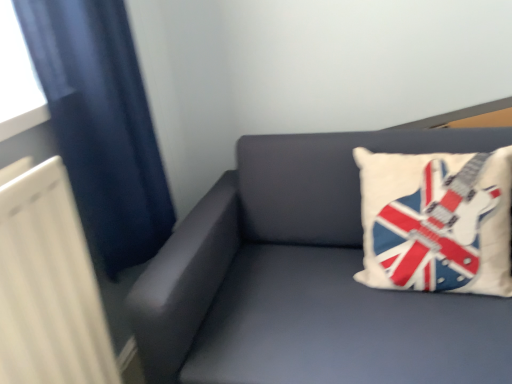
Question: Are white fabric pillow with guitar design at upper right and matte gray couch at upper right located far from each other?

Choices:
 (A) yes
 (B) no

Answer: (B)

Question: Is the position of white fabric pillow with guitar design at upper right more distant than that of matte gray couch at upper right?

Choices:
 (A) yes
 (B) no

Answer: (A)

Question: Is white fabric pillow with guitar design at upper right bigger than matte gray couch at upper right?

Choices:
 (A) no
 (B) yes

Answer: (A)

Question: From the image's perspective, is white fabric pillow with guitar design at upper right under matte gray couch at upper right?

Choices:
 (A) no
 (B) yes

Answer: (A)

Question: Is white fabric pillow with guitar design at upper right oriented away from matte gray couch at upper right?

Choices:
 (A) yes
 (B) no

Answer: (A)

Question: Visually, is white fabric pillow with guitar design at upper right positioned to the left or to the right of dark blue fabric at left?

Choices:
 (A) right
 (B) left

Answer: (A)

Question: In terms of width, does white fabric pillow with guitar design at upper right look wider or thinner when compared to dark blue fabric at left?

Choices:
 (A) wide
 (B) thin

Answer: (A)

Question: From the image's perspective, is white fabric pillow with guitar design at upper right above or below dark blue fabric at left?

Choices:
 (A) below
 (B) above

Answer: (A)

Question: From a real-world perspective, is white fabric pillow with guitar design at upper right positioned above or below dark blue fabric at left?

Choices:
 (A) above
 (B) below

Answer: (B)

Question: Considering the positions of point (105, 175) and point (406, 241), is point (105, 175) closer or farther from the camera than point (406, 241)?

Choices:
 (A) farther
 (B) closer

Answer: (B)

Question: From the image's perspective, is dark blue fabric at left located above or below white fabric pillow with guitar design at upper right?

Choices:
 (A) above
 (B) below

Answer: (A)

Question: Looking at the image, does dark blue fabric at left seem bigger or smaller compared to white fabric pillow with guitar design at upper right?

Choices:
 (A) small
 (B) big

Answer: (B)

Question: Relative to white fabric pillow with guitar design at upper right, is dark blue fabric at left in front or behind?

Choices:
 (A) front
 (B) behind

Answer: (A)

Question: Would you say matte gray couch at upper right is inside or outside dark blue fabric at left?

Choices:
 (A) inside
 (B) outside

Answer: (B)

Question: Based on their sizes in the image, would you say matte gray couch at upper right is bigger or smaller than dark blue fabric at left?

Choices:
 (A) big
 (B) small

Answer: (A)